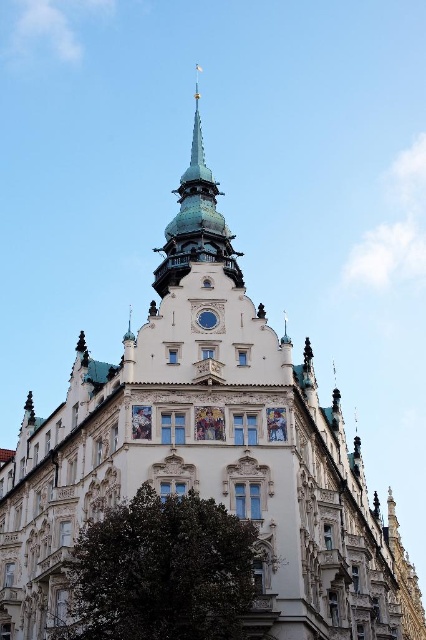
Consider the image. You are a maintenance worker needing to inspect both the green metallic spire at upper center and the blue glass clock at center. Given that your ladder can extend up to 15 meters, can you safely reach both objects without needing additional equipment?

The distance between the green metallic spire at upper center and the blue glass clock at center is 17.42 meters. Since your ladder only extends to 15 meters, you cannot safely reach the higher object without additional equipment.

You are an architect analyzing the building facade. You notice the green metallic spire at upper center and the blue glass clock at center. Which of these two objects has a greater height?

The green metallic spire at upper center is larger in size than the blue glass clock at center, so it has a greater height.